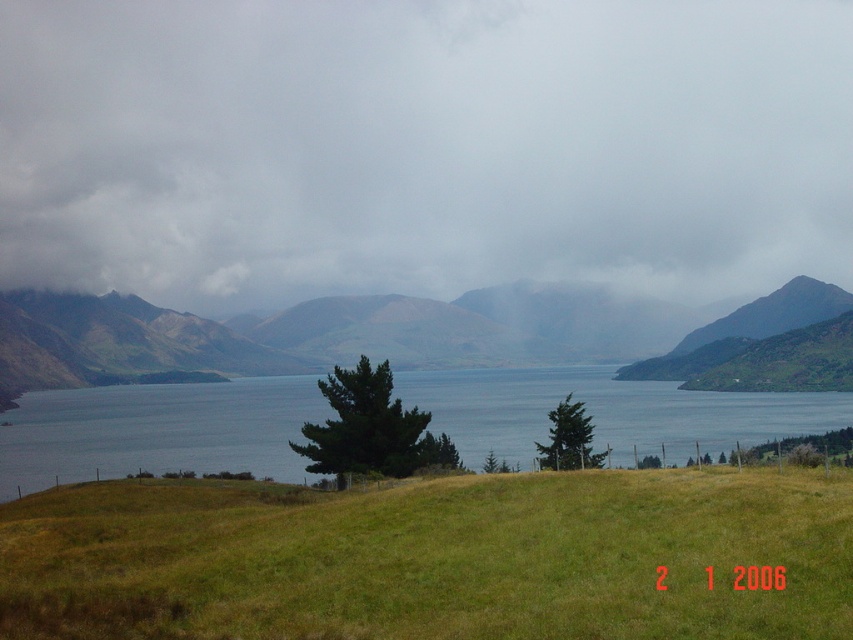
Question: Among these points, which one is farthest from the camera?

Choices:
 (A) (10, 496)
 (B) (334, 228)
 (C) (447, 545)
 (D) (485, 340)

Answer: (B)

Question: Does green grassy hill at lower center appear under blue water at center?

Choices:
 (A) yes
 (B) no

Answer: (B)

Question: Which of these objects is positioned closest to the blue water at center?

Choices:
 (A) green grassy hill at lower center
 (B) green grassy mountain at center

Answer: (B)

Question: Which point appears farthest from the camera in this image?

Choices:
 (A) (828, 280)
 (B) (636, 355)

Answer: (A)

Question: Does gray cloudy sky at upper center come behind green grassy hill at lower center?

Choices:
 (A) yes
 (B) no

Answer: (A)

Question: Can you confirm if green grassy hill at lower center is positioned below green grassy mountain at center?

Choices:
 (A) yes
 (B) no

Answer: (A)